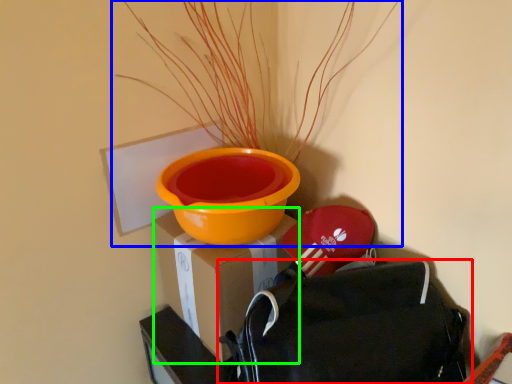
Question: Based on their relative distances, which object is nearer to backpack (highlighted by a red box)? Choose from houseplant (highlighted by a blue box) and cardboard box (highlighted by a green box).

Choices:
 (A) houseplant
 (B) cardboard box

Answer: (B)